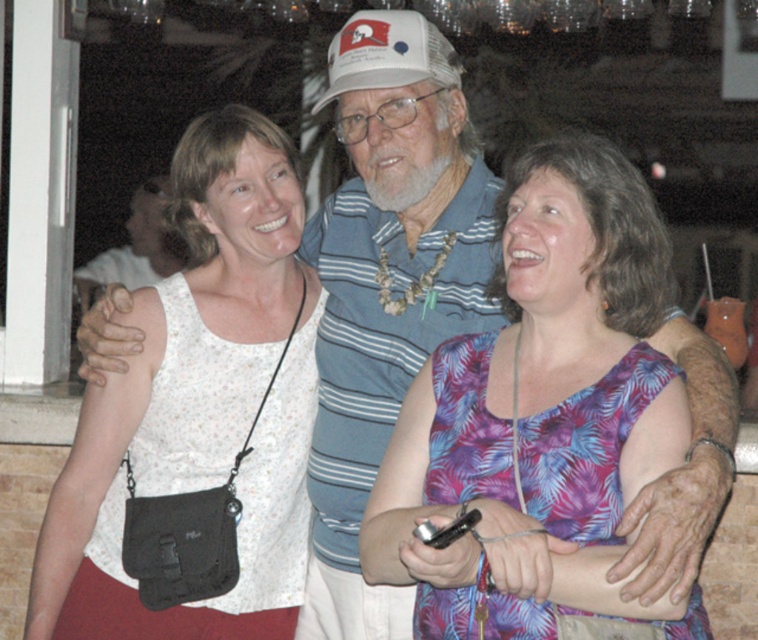
You are a photographer adjusting the lighting for a group photo. You notice the white mesh baseball cap at center and the white fabric tank top at center. Which object is closer to the camera?

The white fabric tank top at center is closer to the camera because the white mesh baseball cap at center is behind it.

You are a photographer trying to capture a group photo of the purple floral dress at center and the white mesh baseball cap at center. Which object should you focus on first to ensure they are both in frame?

The purple floral dress at center is wider than the white mesh baseball cap at center, so you should focus on the purple floral dress at center first to ensure both are in frame.

You are standing in a social setting, possibly a bar or restaurant, and want to take a photo of the group at point (x=631, y=193). If your camera has a maximum focus range of 3 meters, will it be able to focus on the group?

The distance of point (x=631, y=193) from the camera is 3.15 meters, so the camera cannot focus on the group since it exceeds the maximum focus range of 3 meters.